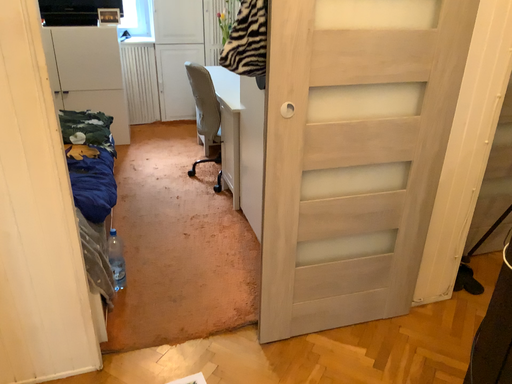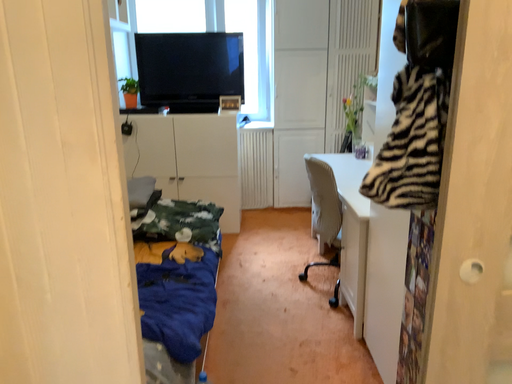
Question: How did the camera likely rotate when shooting the video?

Choices:
 (A) rotated right
 (B) rotated left

Answer: (B)